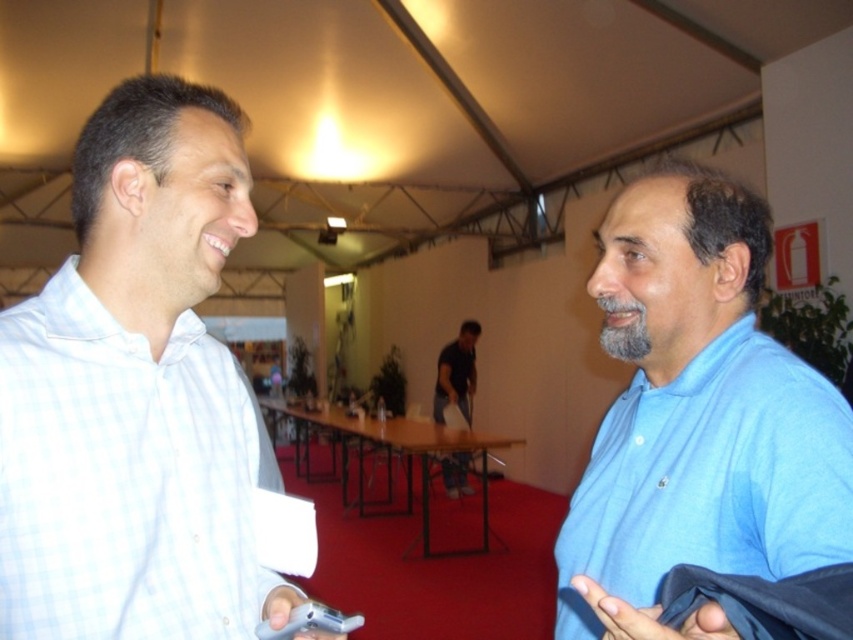
Can you confirm if white checkered shirt at left is taller than dark blue shirt at center?

In fact, white checkered shirt at left may be shorter than dark blue shirt at center.

Can you confirm if white checkered shirt at left is positioned above dark blue shirt at center?

Yes, white checkered shirt at left is above dark blue shirt at center.

Describe the element at coordinates (135, 394) in the screenshot. Image resolution: width=853 pixels, height=640 pixels. I see `white checkered shirt at left` at that location.

Where is `white checkered shirt at left`? white checkered shirt at left is located at coordinates (135, 394).

Is point (666, 456) farther from viewer compared to point (433, 408)?

That is False.

Does blue cotton shirt at right appear on the left side of dark blue shirt at center?

Incorrect, blue cotton shirt at right is not on the left side of dark blue shirt at center.

The width and height of the screenshot is (853, 640). What do you see at coordinates (695, 419) in the screenshot?
I see `blue cotton shirt at right` at bounding box center [695, 419].

The width and height of the screenshot is (853, 640). I want to click on blue cotton shirt at right, so click(695, 419).

Is white checkered shirt at left taller than blue cotton shirt at right?

Yes, white checkered shirt at left is taller than blue cotton shirt at right.

Is white checkered shirt at left shorter than blue cotton shirt at right?

In fact, white checkered shirt at left may be taller than blue cotton shirt at right.

Which is behind, point (183, 280) or point (619, 541)?

The point (183, 280) is behind.

The image size is (853, 640). Identify the location of white checkered shirt at left. (135, 394).